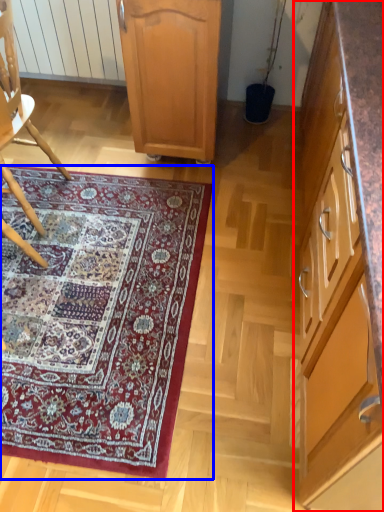
Question: Which object is closer to the camera taking this photo, cabinetry (highlighted by a red box) or mat (highlighted by a blue box)?

Choices:
 (A) cabinetry
 (B) mat

Answer: (A)